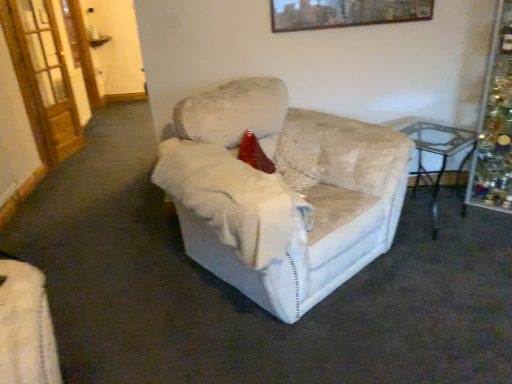
Question: From the image's perspective, is transparent glass table at right over wooden framed artwork at upper center?

Choices:
 (A) yes
 (B) no

Answer: (B)

Question: From the image's perspective, is transparent glass table at right below wooden framed artwork at upper center?

Choices:
 (A) yes
 (B) no

Answer: (A)

Question: Is there a large distance between transparent glass table at right and wooden framed artwork at upper center?

Choices:
 (A) no
 (B) yes

Answer: (A)

Question: Is transparent glass table at right at the right side of wooden framed artwork at upper center?

Choices:
 (A) no
 (B) yes

Answer: (B)

Question: Does transparent glass table at right have a smaller size compared to wooden framed artwork at upper center?

Choices:
 (A) yes
 (B) no

Answer: (B)

Question: Is the depth of transparent glass table at right greater than that of wooden framed artwork at upper center?

Choices:
 (A) no
 (B) yes

Answer: (A)

Question: Is velvet beige armchair at center smaller than wooden door at left?

Choices:
 (A) no
 (B) yes

Answer: (A)

Question: Is velvet beige armchair at center far from wooden door at left?

Choices:
 (A) yes
 (B) no

Answer: (A)

Question: Is the surface of velvet beige armchair at center in direct contact with wooden door at left?

Choices:
 (A) yes
 (B) no

Answer: (B)

Question: From a real-world perspective, is velvet beige armchair at center beneath wooden door at left?

Choices:
 (A) yes
 (B) no

Answer: (A)

Question: Can you confirm if velvet beige armchair at center is taller than wooden door at left?

Choices:
 (A) yes
 (B) no

Answer: (B)

Question: From the image's perspective, would you say velvet beige armchair at center is positioned over wooden door at left?

Choices:
 (A) yes
 (B) no

Answer: (B)

Question: Can you confirm if velvet beige armchair at center is positioned to the left of transparent glass table at right?

Choices:
 (A) yes
 (B) no

Answer: (A)